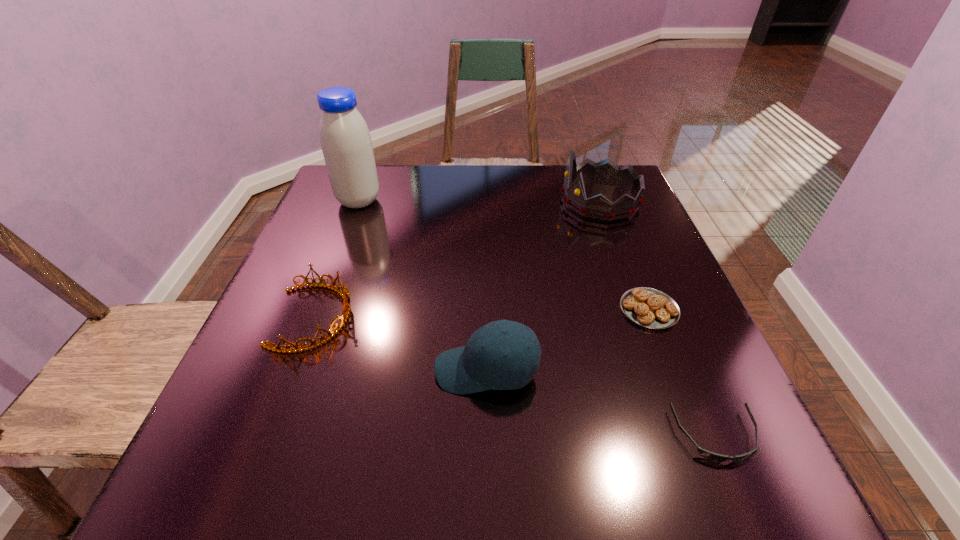
Where is `free spot at the far edge of the desktop`? Image resolution: width=960 pixels, height=540 pixels. free spot at the far edge of the desktop is located at coordinates (490, 205).

Image resolution: width=960 pixels, height=540 pixels. Identify the location of free space at the near edge of the desktop. (464, 460).

In order to click on free space at the left edge of the desktop in this screenshot , I will do `click(333, 233)`.

I want to click on vacant space at the right edge of the desktop, so click(x=622, y=295).

Where is `vacant space at the near left corner`? This screenshot has width=960, height=540. vacant space at the near left corner is located at coordinates (211, 451).

The width and height of the screenshot is (960, 540). I want to click on free space between the farther tiara and the soya milk, so click(x=479, y=201).

I want to click on unoccupied position between the soya milk and the left tiara, so click(336, 259).

The image size is (960, 540). Identify the location of vacant space that's between the pastry and the tallest object. (504, 255).

Locate an element on the screen. free space between the nearest object and the pastry is located at coordinates (683, 373).

This screenshot has width=960, height=540. I want to click on empty space that is in between the soya milk and the pastry, so click(504, 255).